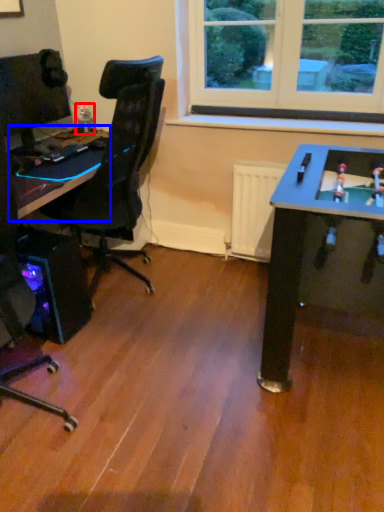
Question: Which object is further to the camera taking this photo, toy (highlighted by a red box) or table (highlighted by a blue box)?

Choices:
 (A) toy
 (B) table

Answer: (A)